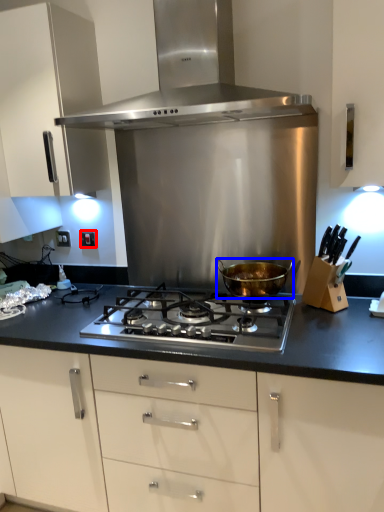
Question: Which object appears closest to the camera in this image, electric outlet (highlighted by a red box) or kitchen appliance (highlighted by a blue box)?

Choices:
 (A) electric outlet
 (B) kitchen appliance

Answer: (B)